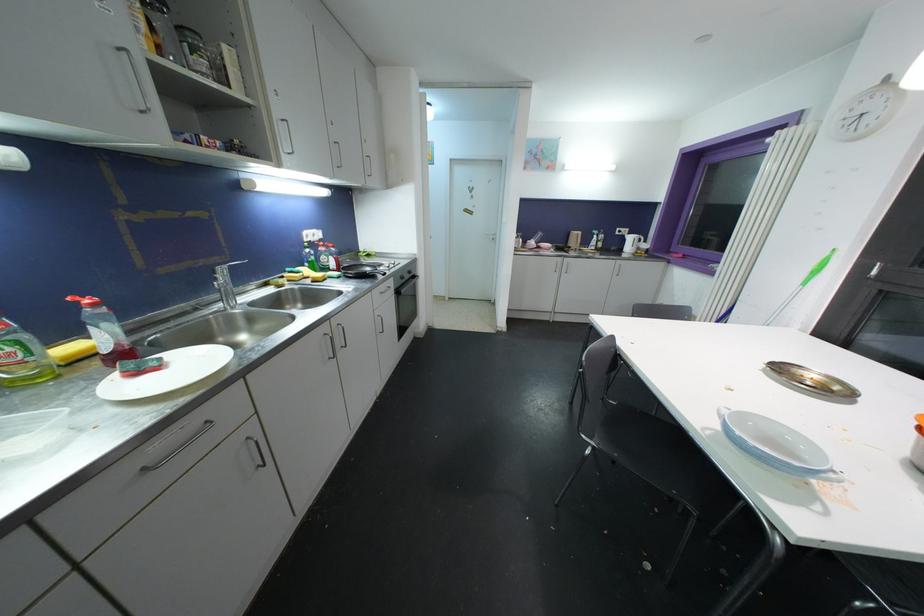
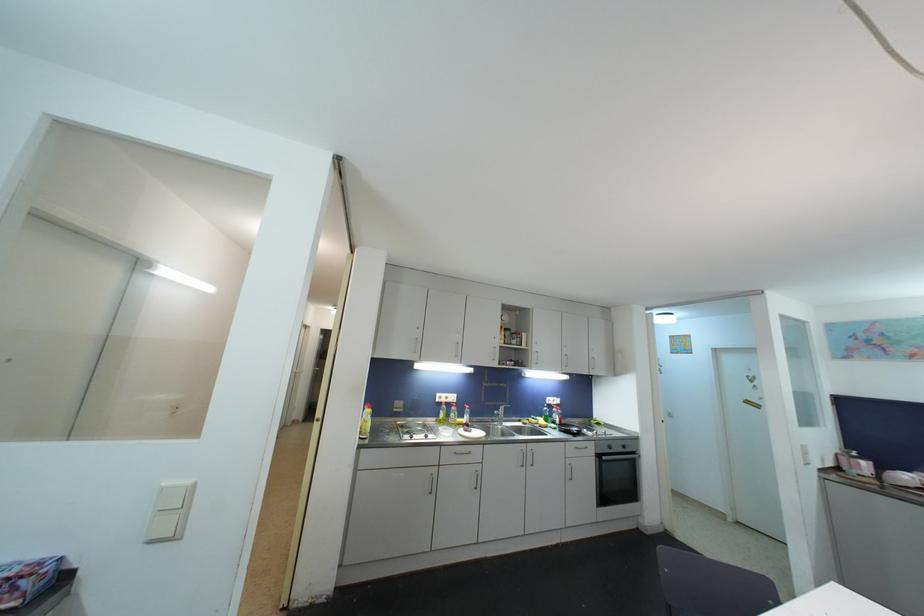
Locate, in the second image, the point that corresponds to (x=379, y=318) in the first image.

(570, 464)